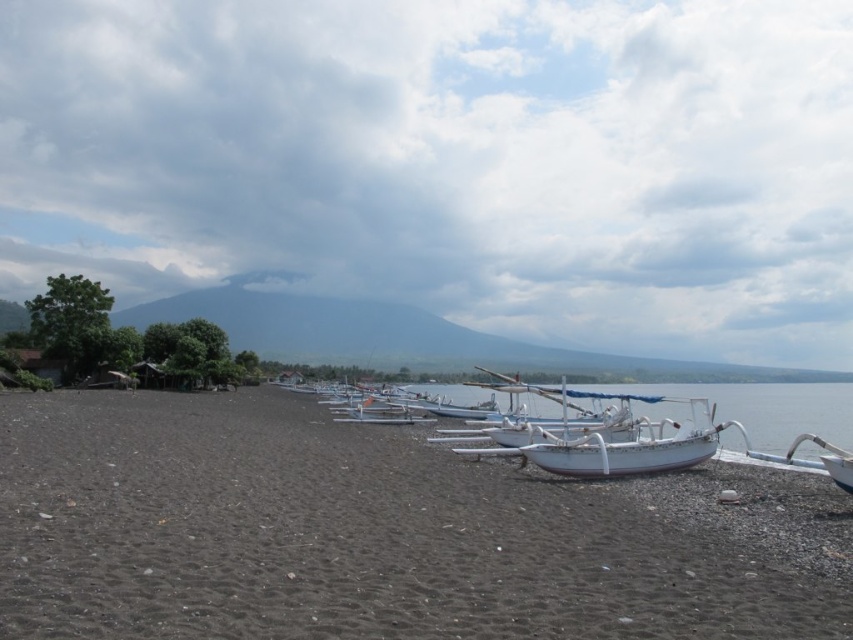
You are standing at the beach looking towards the mountains. There are two points marked in the image. The first point is at coordinates point (42, 573) and the second is at point (529, 456). Which point is located closer to you?

Point (42, 573) is closer to the viewer than point (529, 456).

You are planning to build a small sandcastle on the beach. You have a bucket that can hold up to 10 liters of sand. The dark brown gravel at center and the white glossy boat at center are in your way. Which object should you move to make space for your sandcastle?

The dark brown gravel at center has a larger width than the white glossy boat at center, so you should move the dark brown gravel at center to create more space for your sandcastle.